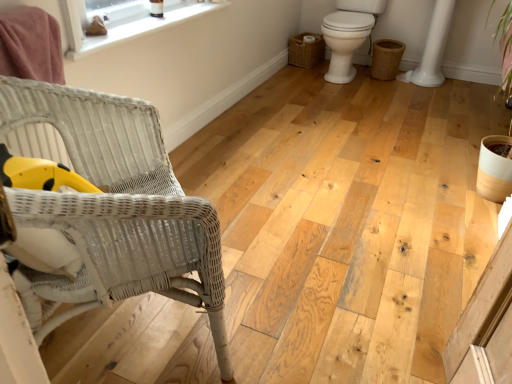
Locate an element on the screen. empty space that is ontop of white smooth window sill at upper left (from a real-world perspective) is located at coordinates (160, 17).